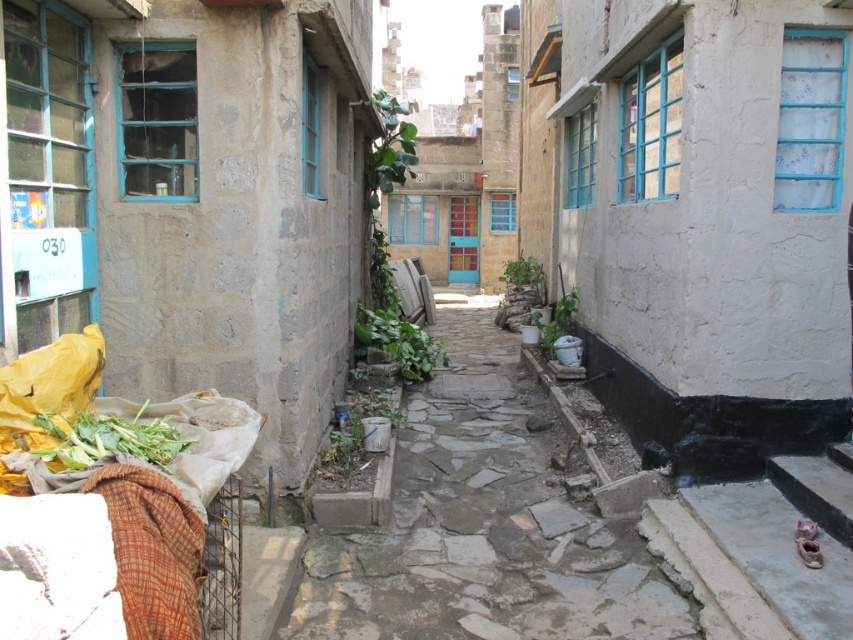
Question: Does rusty metal planter at center come in front of green leafy vegetables at lower left?

Choices:
 (A) no
 (B) yes

Answer: (A)

Question: Based on their relative distances, which object is nearer to the green leafy plant at center?

Choices:
 (A) rusty metal planter at center
 (B) green leafy vegetables at lower left

Answer: (A)

Question: Is the position of green leafy vegetables at lower left less distant than that of green leafy plant at center?

Choices:
 (A) no
 (B) yes

Answer: (B)

Question: Is green leafy vegetables at lower left smaller than green leafy plant at center?

Choices:
 (A) yes
 (B) no

Answer: (A)

Question: Which point is farther to the camera?

Choices:
 (A) (86, 442)
 (B) (408, 348)
 (C) (543, 474)

Answer: (B)

Question: Which object appears farthest from the camera in this image?

Choices:
 (A) green leafy vegetables at lower left
 (B) rusty metal planter at center
 (C) green leafy plant at center

Answer: (C)